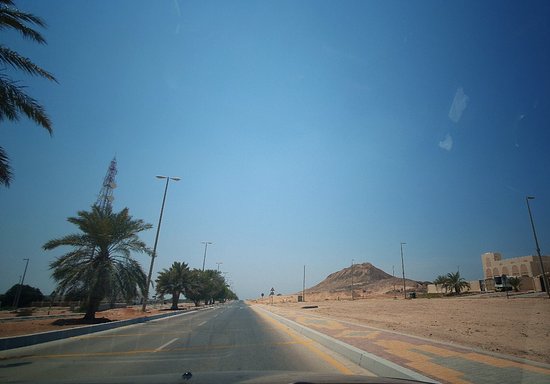
In order to click on brick wall in this screenshot , I will do `click(42, 303)`.